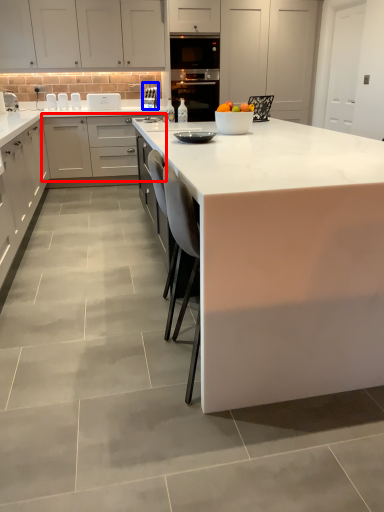
Question: Which object is further to the camera taking this photo, cabinetry (highlighted by a red box) or appliance (highlighted by a blue box)?

Choices:
 (A) cabinetry
 (B) appliance

Answer: (B)